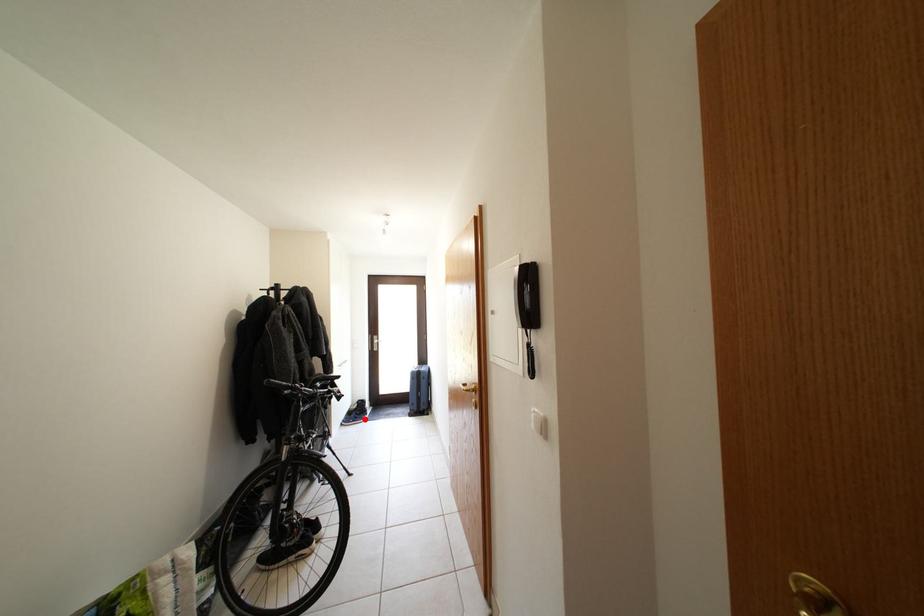
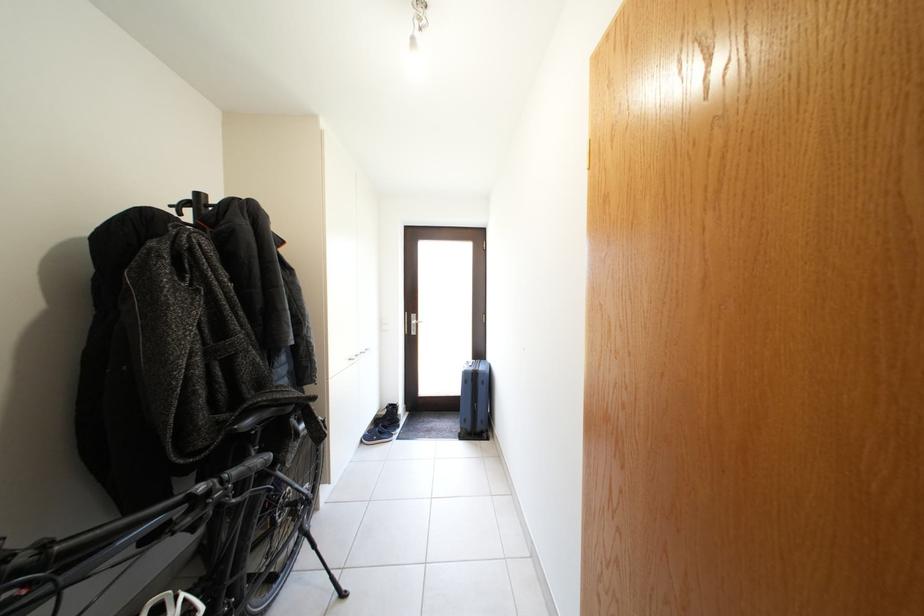
Question: I am providing you with two images of the same scene from different viewpoints. Image1 has a red point marked. In image2, the corresponding 3D location appears at what relative position? Reply with the corresponding letter.

Choices:
 (A) Closer
 (B) Farther

Answer: (A)